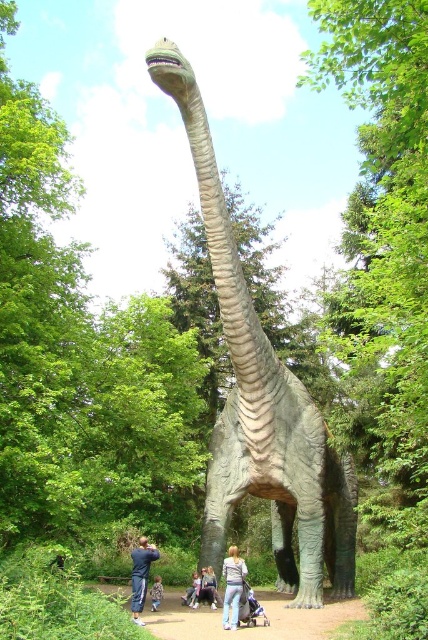
You are a fashion designer observing the two pairs of pants displayed in the image. Which pair of pants, the light blue jeans at lower center or the light brown fabric pants at lower center, is taller?

The light blue jeans at lower center has a greater height compared to the light brown fabric pants at lower center.